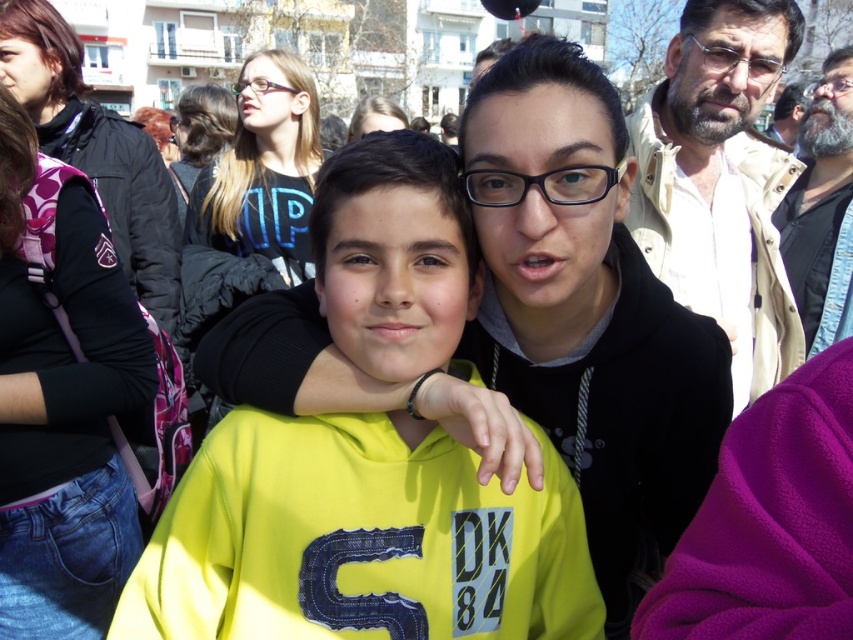
Question: Which is nearer to the beige fabric jacket at upper right?

Choices:
 (A) matte black hoodie at center
 (B) bearded man at right
 (C) denim jacket at left
 (D) matte black hair at center

Answer: (B)

Question: Among these objects, which one is farthest from the camera?

Choices:
 (A) denim jacket at left
 (B) beige fabric jacket at upper right
 (C) matte black hoodie at center
 (D) bearded man at right

Answer: (D)

Question: Is yellow matte hoodie at center positioned behind denim jacket at left?

Choices:
 (A) yes
 (B) no

Answer: (B)

Question: Can you confirm if denim jacket at left is positioned to the left of matte black hair at center?

Choices:
 (A) yes
 (B) no

Answer: (A)

Question: Estimate the real-world distances between objects in this image. Which object is farther from the beige fabric jacket at upper right?

Choices:
 (A) matte black hoodie at center
 (B) matte black hair at center
 (C) bearded man at right

Answer: (B)

Question: Is matte black hoodie at center further to the viewer compared to matte black hair at center?

Choices:
 (A) no
 (B) yes

Answer: (A)